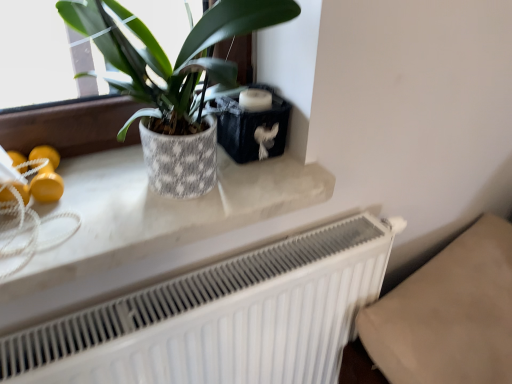
The width and height of the screenshot is (512, 384). What are the coordinates of `free spot above white matte radiator at lower center (from a real-world perspective)` in the screenshot? It's located at (256, 269).